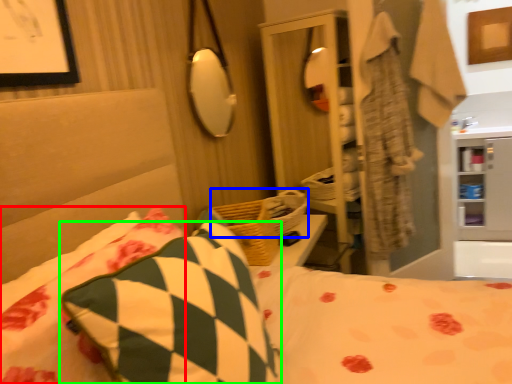
Question: Based on their relative distances, which object is nearer to pillow (highlighted by a red box)? Choose from basket (highlighted by a blue box) and pillow (highlighted by a green box).

Choices:
 (A) basket
 (B) pillow

Answer: (B)